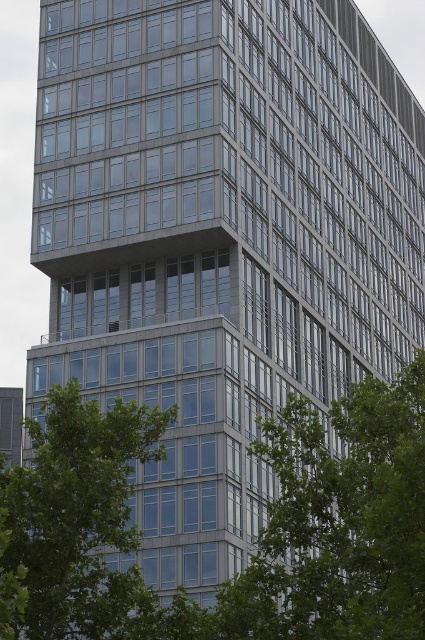
Consider the image. Does green leafy tree at center have a lesser height compared to green leafy tree at lower left?

No, green leafy tree at center is not shorter than green leafy tree at lower left.

Can you confirm if green leafy tree at center is bigger than green leafy tree at lower left?

Yes.

In the scene shown: Who is more distant from viewer, (x=300, y=460) or (x=45, y=518)?

Positioned behind is point (x=300, y=460).

This screenshot has height=640, width=425. Identify the location of green leafy tree at center. (340, 522).